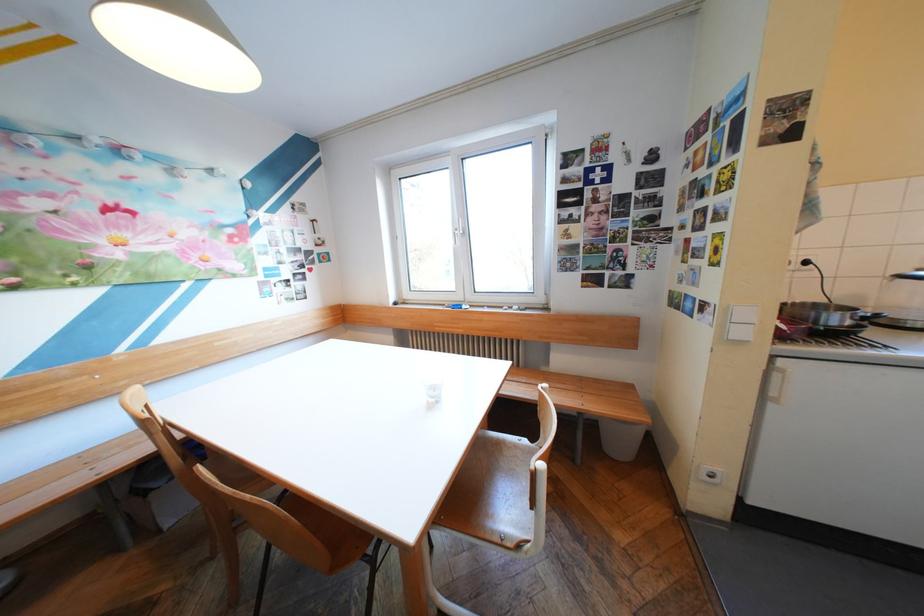
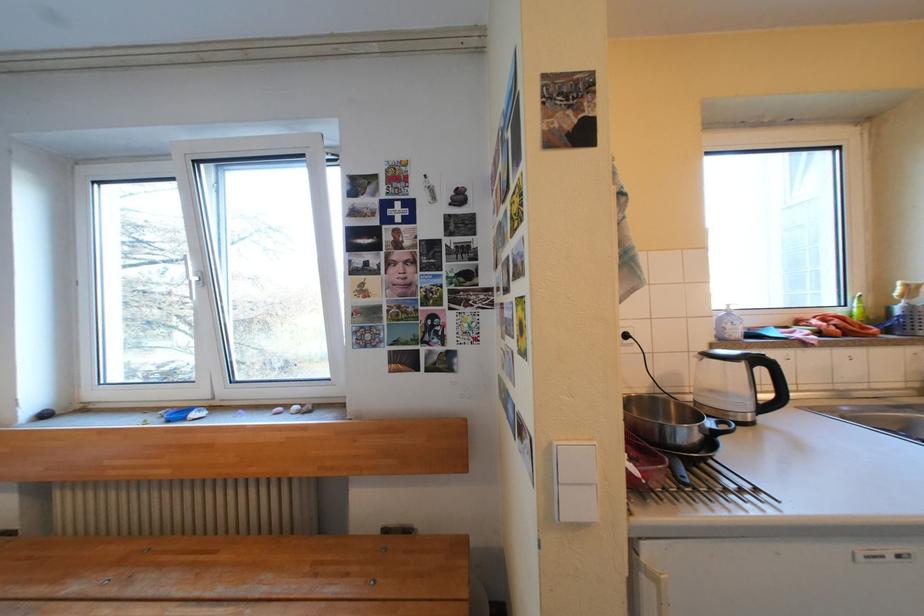
Question: The camera is either moving clockwise (left) or counter-clockwise (right) around the object. The first image is from the beginning of the video and the second image is from the end. Is the camera moving left or right when shooting the video?

Choices:
 (A) Left
 (B) Right

Answer: (A)